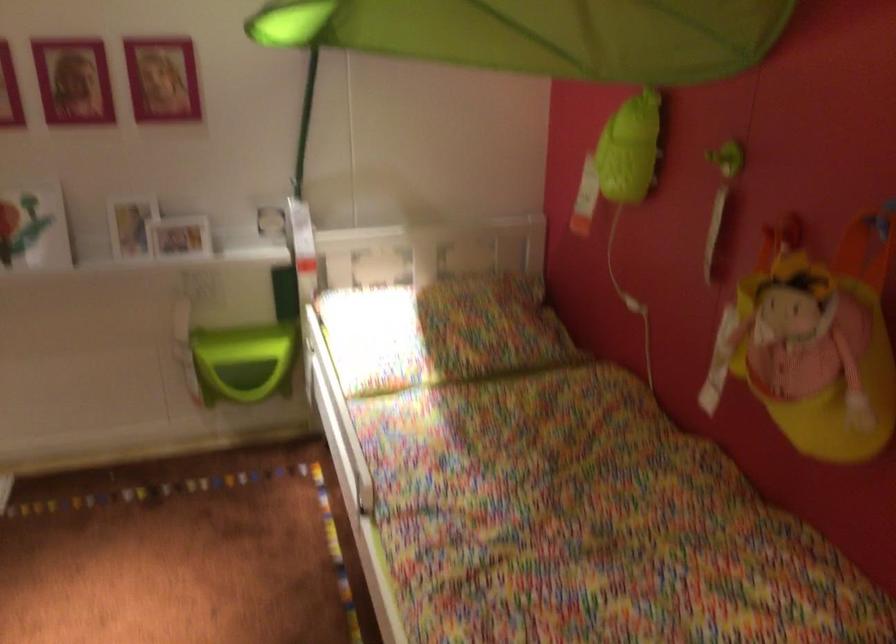
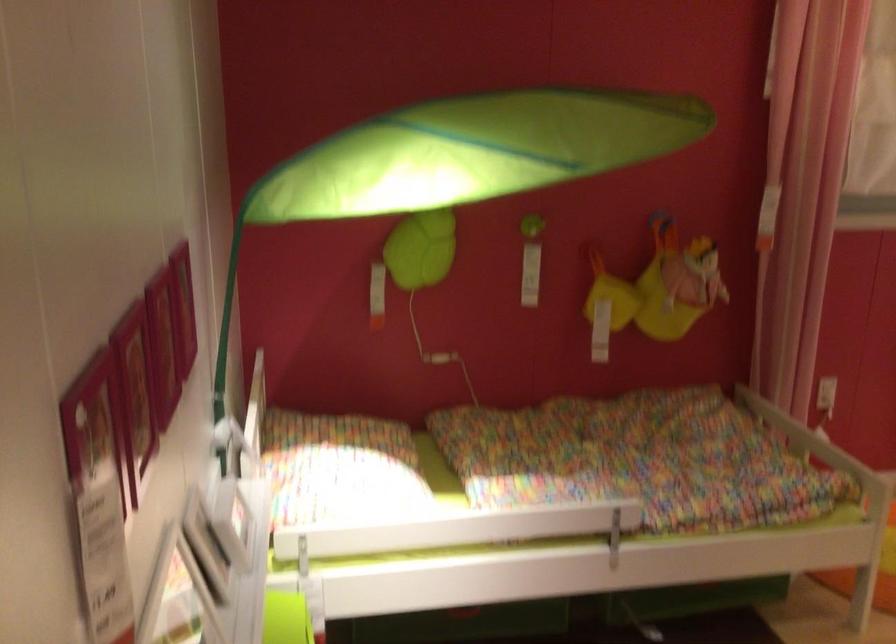
Find the pixel in the second image that matches (306,140) in the first image.

(226, 339)